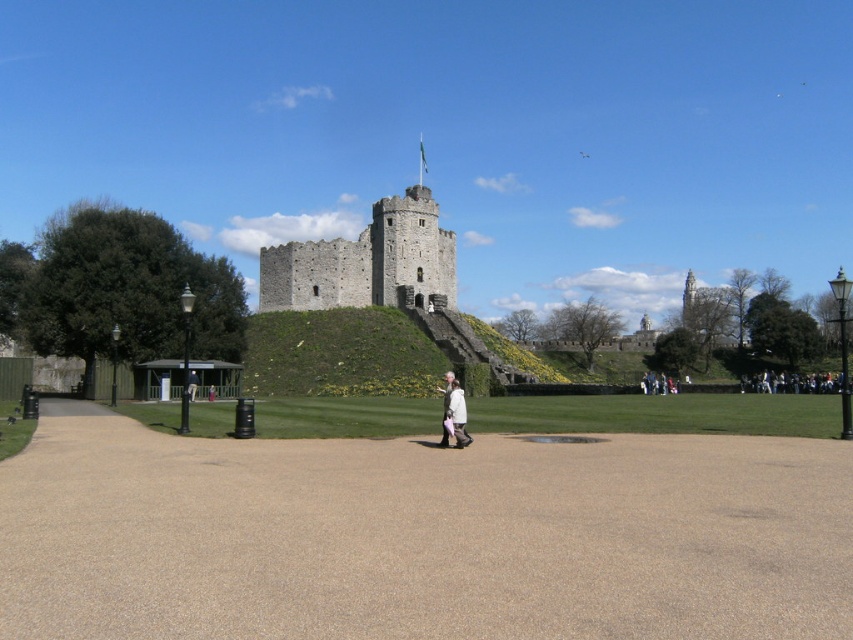
You are standing at the entrance of the castle pathway and see a point marked at coordinates (457,413). What object is located at that point?

The point at coordinates (457,413) corresponds to the white fabric at center.

You are a visitor standing at the entrance of the castle pathway. You see a white fabric at center and a brown leather jacket at center. Which item is narrower?

The white fabric at center is narrower than the brown leather jacket at center.

You are standing at the entrance of the castle and see the brown gravel path at center and the brown leather jacket at center. Which object is closer to you?

The brown gravel path at center is closer to you since it is 24.64 meters away from the brown leather jacket at center, meaning the jacket is farther away.